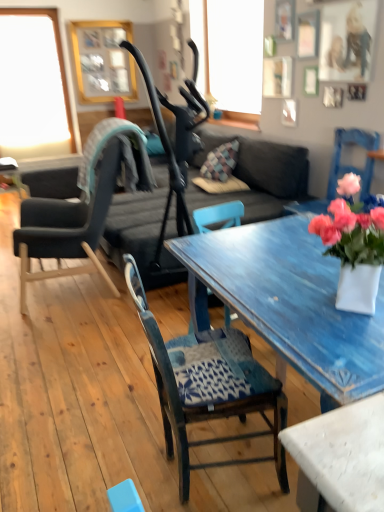
Question: From a real-world perspective, is dark gray fabric couch at center positioned under transparent glass window at upper left based on gravity?

Choices:
 (A) yes
 (B) no

Answer: (A)

Question: Is dark gray fabric couch at center smaller than transparent glass window at upper left?

Choices:
 (A) no
 (B) yes

Answer: (A)

Question: From a real-world perspective, does dark gray fabric couch at center stand above transparent glass window at upper left?

Choices:
 (A) yes
 (B) no

Answer: (B)

Question: From the image's perspective, is dark gray fabric couch at center on top of transparent glass window at upper left?

Choices:
 (A) yes
 (B) no

Answer: (B)

Question: Is dark gray fabric couch at center outside transparent glass window at upper left?

Choices:
 (A) no
 (B) yes

Answer: (B)

Question: From the image's perspective, is dark gray fabric couch at center under transparent glass window at upper left?

Choices:
 (A) yes
 (B) no

Answer: (A)

Question: Considering the relative sizes of gold wooden picture frame at upper center and pink matte vase at right in the image provided, is gold wooden picture frame at upper center thinner than pink matte vase at right?

Choices:
 (A) yes
 (B) no

Answer: (A)

Question: Can we say gold wooden picture frame at upper center lies outside pink matte vase at right?

Choices:
 (A) yes
 (B) no

Answer: (A)

Question: From the image's perspective, does gold wooden picture frame at upper center appear lower than pink matte vase at right?

Choices:
 (A) no
 (B) yes

Answer: (A)

Question: Is gold wooden picture frame at upper center oriented towards pink matte vase at right?

Choices:
 (A) no
 (B) yes

Answer: (B)

Question: Does gold wooden picture frame at upper center appear on the right side of pink matte vase at right?

Choices:
 (A) no
 (B) yes

Answer: (A)

Question: From a real-world perspective, is gold wooden picture frame at upper center located higher than pink matte vase at right?

Choices:
 (A) yes
 (B) no

Answer: (A)

Question: Is wooden chair with patterned cushion at center, the 2th chair positioned from the left, far from gold wooden picture frame at upper center?

Choices:
 (A) no
 (B) yes

Answer: (B)